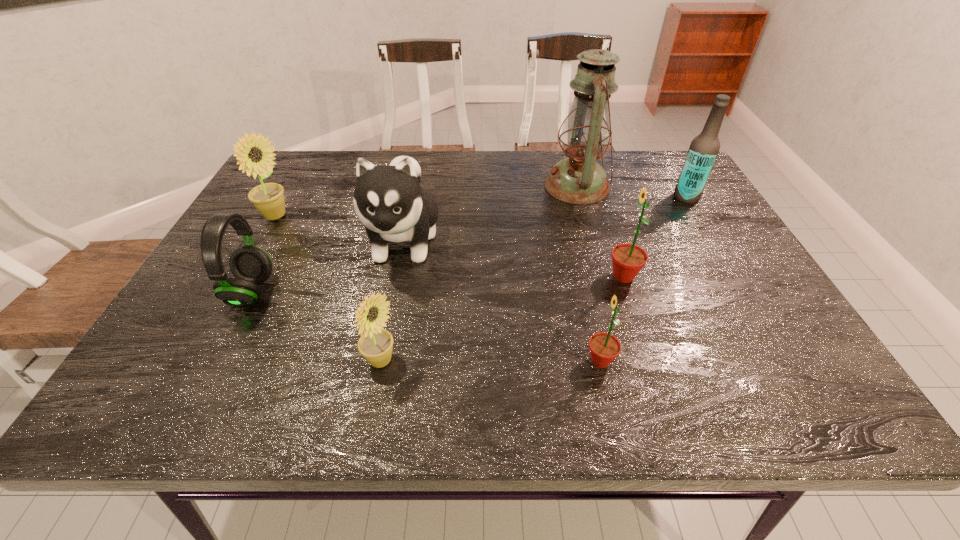
Where is `object present at the right edge`? object present at the right edge is located at coordinates (704, 148).

Image resolution: width=960 pixels, height=540 pixels. Identify the location of object that is at the far right corner. (704, 148).

The image size is (960, 540). In the image, there is a desktop. Find the location of `vacant space at the far edge`. vacant space at the far edge is located at coordinates (621, 168).

In the image, there is a desktop. Identify the location of vacant space at the near edge. The width and height of the screenshot is (960, 540). (296, 395).

Where is `vacant space at the left edge of the desktop`? The width and height of the screenshot is (960, 540). vacant space at the left edge of the desktop is located at coordinates (254, 217).

Find the location of a particular element. This screenshot has height=540, width=960. vacant space at the right edge is located at coordinates (740, 325).

This screenshot has height=540, width=960. In the image, there is a desktop. What are the coordinates of `vacant space at the far left corner` in the screenshot? It's located at (297, 179).

Locate an element on the screen. The image size is (960, 540). free space at the near left corner is located at coordinates (169, 397).

Find the location of `free spot between the smaller green sunflower and the white puppy`. free spot between the smaller green sunflower and the white puppy is located at coordinates (502, 300).

Locate an element on the screen. Image resolution: width=960 pixels, height=540 pixels. vacant area between the oil lamp and the puppy is located at coordinates (491, 213).